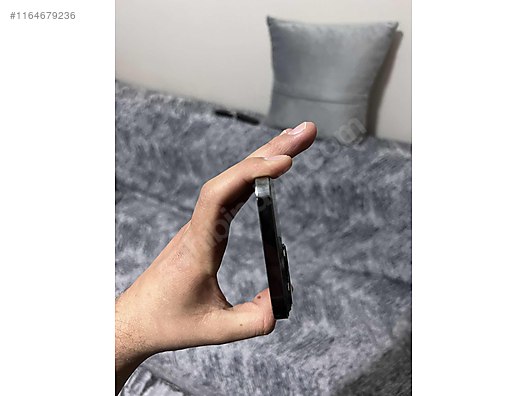
Locate an element on the screen. light grey wall is located at coordinates (234, 58).